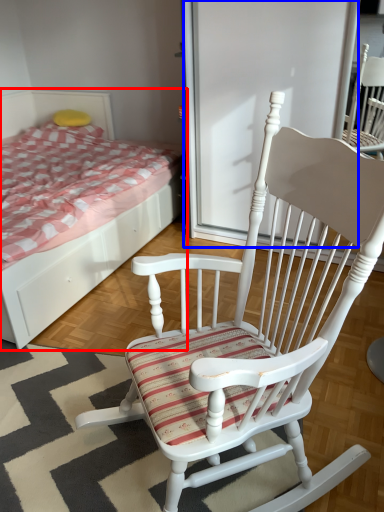
Question: Among these objects, which one is nearest to the camera, bed (highlighted by a red box) or screen door (highlighted by a blue box)?

Choices:
 (A) bed
 (B) screen door

Answer: (A)